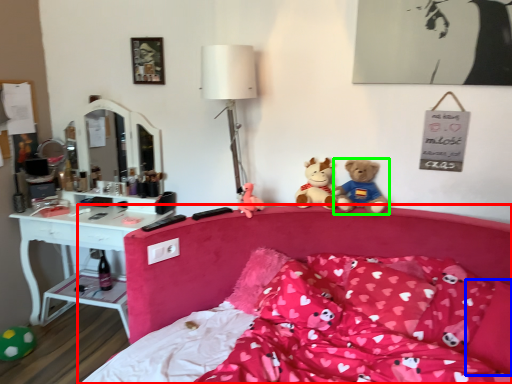
Question: Considering the real-world distances, which object is farthest from bed (highlighted by a red box)? pillow (highlighted by a blue box) or teddy bear (highlighted by a green box)?

Choices:
 (A) pillow
 (B) teddy bear

Answer: (A)